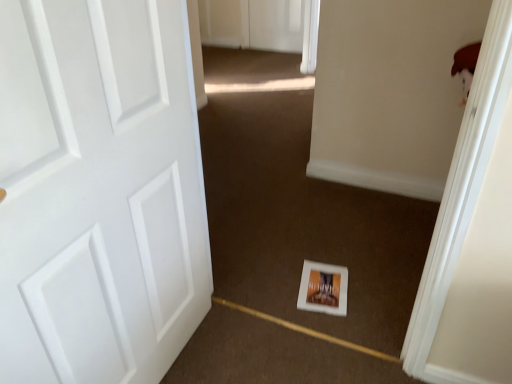
What do you see at coordinates (323, 288) in the screenshot?
I see `white matte postcard at center` at bounding box center [323, 288].

The width and height of the screenshot is (512, 384). What are the coordinates of `white matte postcard at center` in the screenshot? It's located at (323, 288).

Locate an element on the screen. white matte door at left is located at coordinates (99, 191).

What do you see at coordinates (99, 191) in the screenshot? I see `white matte door at left` at bounding box center [99, 191].

Locate an element on the screen. The width and height of the screenshot is (512, 384). white matte postcard at center is located at coordinates (323, 288).

Is white matte door at left at the right side of white matte postcard at center?

In fact, white matte door at left is to the left of white matte postcard at center.

From the picture: Does white matte door at left lie in front of white matte postcard at center?

Yes, white matte door at left is in front of white matte postcard at center.

Is point (187, 149) closer or farther from the camera than point (302, 291)?

Point (187, 149) is closer to the camera than point (302, 291).

From the image's perspective, is white matte door at left above or below white matte postcard at center?

Clearly, from the image's perspective, white matte door at left is above white matte postcard at center.

From a real-world perspective, between white matte door at left and white matte postcard at center, who is vertically lower?

white matte postcard at center is physically lower.

Between white matte door at left and white matte postcard at center, which one has larger width?

Wider between the two is white matte postcard at center.

Based on the photo, which of these two, white matte door at left or white matte postcard at center, stands taller?

white matte door at left is taller.

From the picture: Who is smaller, white matte door at left or white matte postcard at center?

Smaller between the two is white matte postcard at center.

Is white matte postcard at center completely or partially inside white matte door at left?

No, white matte postcard at center is not a part of white matte door at left.

Is white matte door at left next to white matte postcard at center and touching it?

They are not placed beside each other.

Could you tell me if white matte door at left is turned towards white matte postcard at center?

No, white matte door at left is not facing towards white matte postcard at center.

How different are the orientations of white matte door at left and white matte postcard at center in degrees?

white matte door at left and white matte postcard at center are facing 80.5 degrees away from each other.

The width and height of the screenshot is (512, 384). In order to click on door that appears above the white matte postcard at center (from the image's perspective) in this screenshot , I will do (x=99, y=191).

Considering the positions of objects white matte postcard at center and white matte door at left in the image provided, who is more to the right, white matte postcard at center or white matte door at left?

white matte postcard at center is more to the right.

In the scene shown: Does white matte postcard at center lie behind white matte door at left?

Yes, white matte postcard at center is further from the viewer.

From the picture: Which is closer, [304,307] or [111,318]?

Point [304,307] is positioned farther from the camera compared to point [111,318].

From the image's perspective, which one is positioned higher, white matte postcard at center or white matte door at left?

white matte door at left.

From a real-world perspective, is white matte postcard at center below white matte door at left?

Correct, in the physical world, white matte postcard at center is lower than white matte door at left.

Consider the image. Is white matte postcard at center wider than white matte door at left?

Yes.

Between white matte postcard at center and white matte door at left, which one has more height?

white matte door at left is taller.

Between white matte postcard at center and white matte door at left, which one has smaller size?

white matte postcard at center is smaller.

Would you say white matte postcard at center contains white matte door at left?

No, white matte door at left is not a part of white matte postcard at center.

Is white matte postcard at center far from white matte door at left?

No, white matte postcard at center is not far away from white matte door at left.

Is white matte postcard at center oriented towards white matte door at left?

No.

Identify the location of postcard behind the white matte door at left. The height and width of the screenshot is (384, 512). (323, 288).

You are a GUI agent. You are given a task and a screenshot of the screen. Output one action in this format:
    pyautogui.click(x=<x>, y=<y>)
    Task: Click on the door on the left of white matte postcard at center
    The image size is (512, 384).
    Given the screenshot: What is the action you would take?
    pyautogui.click(x=99, y=191)

You are a GUI agent. You are given a task and a screenshot of the screen. Output one action in this format:
    pyautogui.click(x=<x>, y=<y>)
    Task: Click on the postcard below the white matte door at left (from the image's perspective)
    
    Given the screenshot: What is the action you would take?
    pyautogui.click(x=323, y=288)